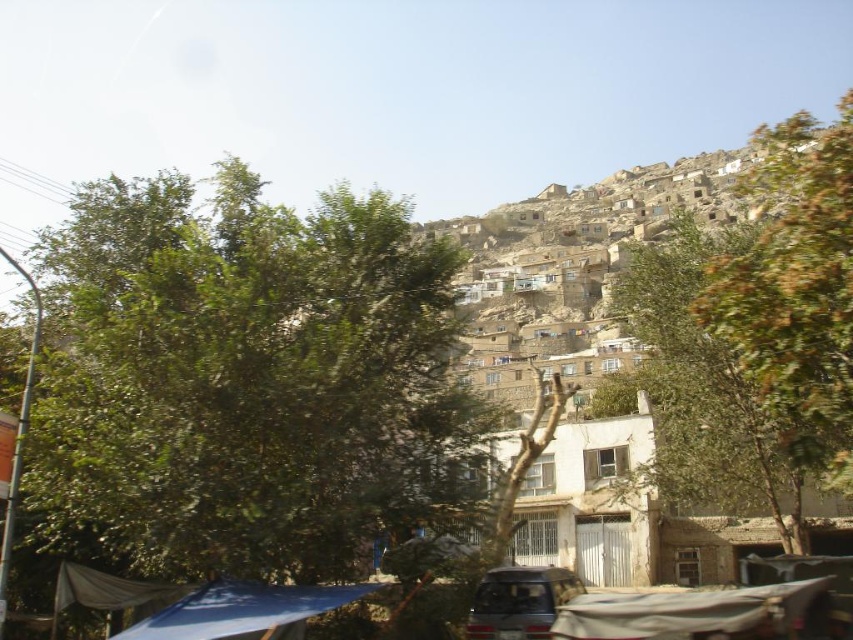
You are standing at the base of the hillside settlement and want to shade yourself from the sun. You notice the green leafy tree at upper center and the blue fabric canopy at lower center. Which of these two objects would provide more shade coverage?

The green leafy tree at upper center is taller than the blue fabric canopy at lower center, so it would provide more shade coverage.

You are a hiker standing at the base of the hillside settlement. You see the green leafy tree at upper center and the blue fabric canopy at lower center. You want to place a 40 meter long rope between them to create a zip line. Will the rope be long enough?

The distance between the green leafy tree at upper center and the blue fabric canopy at lower center is 38.72 meters. The 40 meter long rope is longer than the required distance, so it will be sufficient to create the zip line.

You are standing at the base of the hillside settlement and notice the green leafy tree at upper center and the blue fabric canopy at lower center. Which object is positioned higher up the slope?

The green leafy tree at upper center is positioned higher up the slope than the blue fabric canopy at lower center because it is above it.